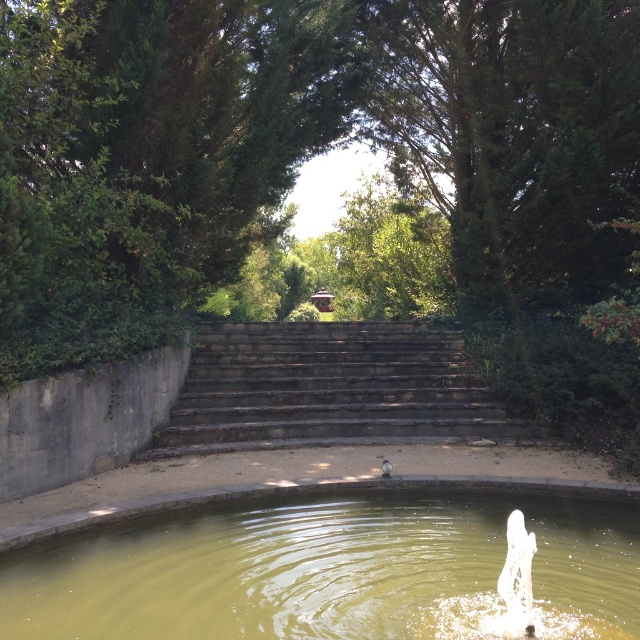
Can you confirm if greenish water at center is wider than dark gray stone stairs at center?

Correct, the width of greenish water at center exceeds that of dark gray stone stairs at center.

Does greenish water at center appear on the right side of dark gray stone stairs at center?

In fact, greenish water at center is to the left of dark gray stone stairs at center.

Is point (440, 508) less distant than point (435, 362)?

That is True.

In order to click on greenish water at center in this screenshot , I will do pos(332,570).